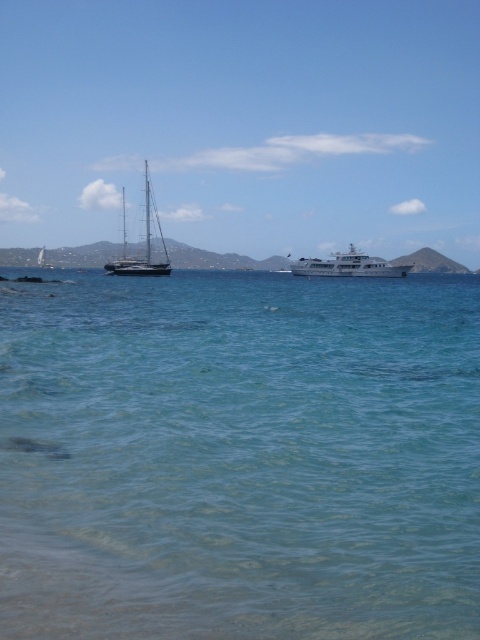
Question: Which is farther from the white glossy yacht at center?

Choices:
 (A) shiny silver sailboat at left
 (B) clear water at lower center

Answer: (B)

Question: Does white glossy yacht at center come in front of shiny silver sailboat at left?

Choices:
 (A) yes
 (B) no

Answer: (B)

Question: Is clear water at lower center to the left of shiny silver sailboat at left from the viewer's perspective?

Choices:
 (A) no
 (B) yes

Answer: (A)

Question: Considering the real-world distances, which object is closest to the clear water at lower center?

Choices:
 (A) white glossy yacht at center
 (B) shiny silver sailboat at left

Answer: (A)

Question: Does clear water at lower center appear under shiny silver sailboat at left?

Choices:
 (A) no
 (B) yes

Answer: (B)

Question: Which point is closer to the camera taking this photo?

Choices:
 (A) (305, 262)
 (B) (146, 227)

Answer: (A)